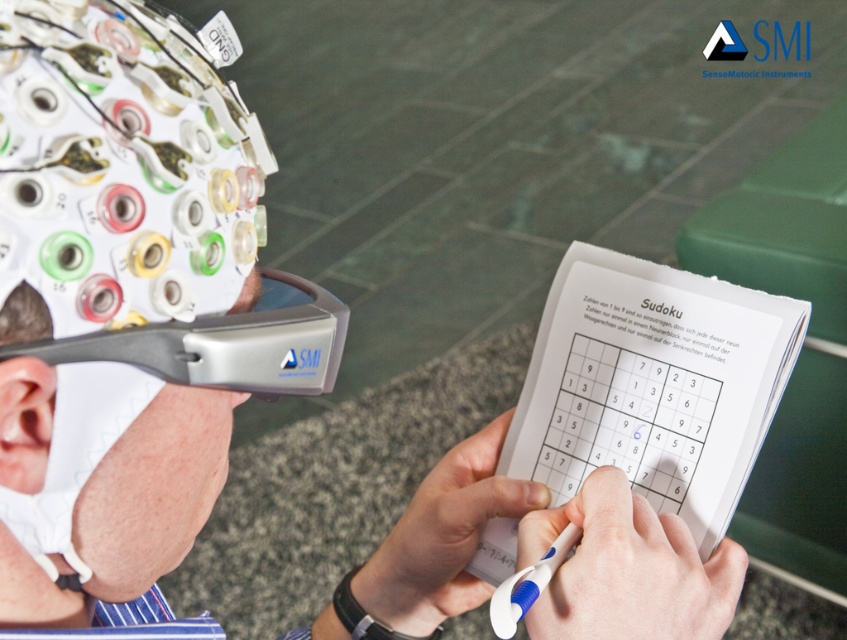
Can you confirm if white paper sudoku at center is bigger than silver metallic goggles at upper left?

Indeed, white paper sudoku at center has a larger size compared to silver metallic goggles at upper left.

How much distance is there between white paper sudoku at center and silver metallic goggles at upper left?

white paper sudoku at center is 11.52 inches away from silver metallic goggles at upper left.

Who is more forward, (480, 577) or (291, 332)?

Point (291, 332) is in front.

Image resolution: width=847 pixels, height=640 pixels. Find the location of `white paper sudoku at center`. white paper sudoku at center is located at coordinates (652, 385).

From the picture: Does matte gray helmet at upper left have a lesser height compared to white paper sudoku at center?

Indeed, matte gray helmet at upper left has a lesser height compared to white paper sudoku at center.

Is point (36, 458) closer to camera compared to point (743, 435)?

Yes, point (36, 458) is in front of point (743, 435).

Does point (141, 452) come farther from viewer compared to point (701, 401)?

No, it is not.

The image size is (847, 640). In order to click on matte gray helmet at upper left in this screenshot , I will do `click(537, 557)`.

Between matte gray helmet at upper left and silver metallic goggles at upper left, which one has less height?

silver metallic goggles at upper left

Based on the photo, which is above, matte gray helmet at upper left or silver metallic goggles at upper left?

Positioned higher is silver metallic goggles at upper left.

Between point (180, 396) and point (100, 349), which one is positioned behind?

The point (180, 396) is behind.

Locate an element on the screen. The image size is (847, 640). matte gray helmet at upper left is located at coordinates (537, 557).